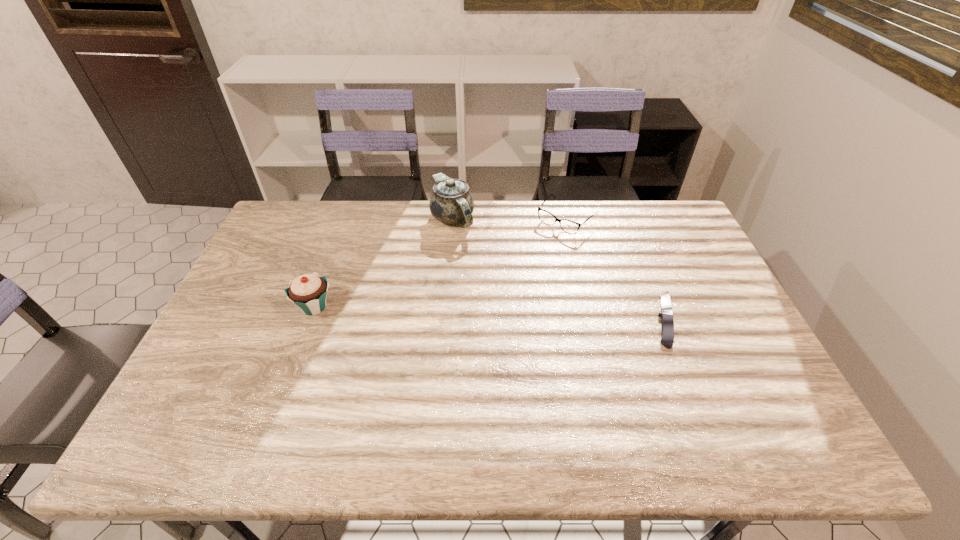
Image resolution: width=960 pixels, height=540 pixels. I want to click on free point at the left edge, so click(x=217, y=346).

Image resolution: width=960 pixels, height=540 pixels. I want to click on free space at the right edge, so click(x=705, y=362).

This screenshot has height=540, width=960. In order to click on free region at the far left corner in this screenshot , I will do [290, 210].

In the image, there is a desktop. At what (x,y) coordinates should I click in order to perform the action: click on free region at the near left corner. Please return your answer as a coordinate pair (x, y). The image size is (960, 540). Looking at the image, I should click on (227, 410).

I want to click on free space at the far right corner, so click(x=659, y=204).

In the image, there is a desktop. Where is `vacant area at the near right corner`? vacant area at the near right corner is located at coordinates (731, 384).

I want to click on vacant space in between the chinaware and the leftmost object, so click(383, 262).

This screenshot has height=540, width=960. I want to click on unoccupied area between the rightmost object and the tallest object, so click(x=559, y=269).

At what (x,y) coordinates should I click in order to perform the action: click on vacant space in between the third object from right to left and the shortest object. Please return your answer as a coordinate pair (x, y). Looking at the image, I should click on (559, 269).

Where is `free point between the chinaware and the third object from left to right`? free point between the chinaware and the third object from left to right is located at coordinates (510, 219).